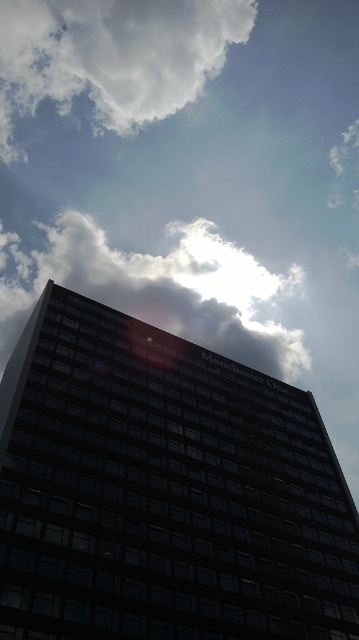
Question: Can you confirm if white fluffy cloud at upper left is thinner than white fluffy cloud at upper center?

Choices:
 (A) no
 (B) yes

Answer: (B)

Question: Which point appears closest to the camera in this image?

Choices:
 (A) (225, 316)
 (B) (109, 97)

Answer: (A)

Question: Is white fluffy cloud at upper left below white fluffy cloud at upper center?

Choices:
 (A) yes
 (B) no

Answer: (B)

Question: Which object is closer to the camera taking this photo?

Choices:
 (A) white fluffy cloud at upper left
 (B) white fluffy cloud at upper center

Answer: (B)

Question: Which point is farther from the camera taking this photo?

Choices:
 (A) (100, 77)
 (B) (42, 278)

Answer: (A)

Question: Observing the image, what is the correct spatial positioning of white fluffy cloud at upper left in reference to white fluffy cloud at upper center?

Choices:
 (A) below
 (B) above

Answer: (B)